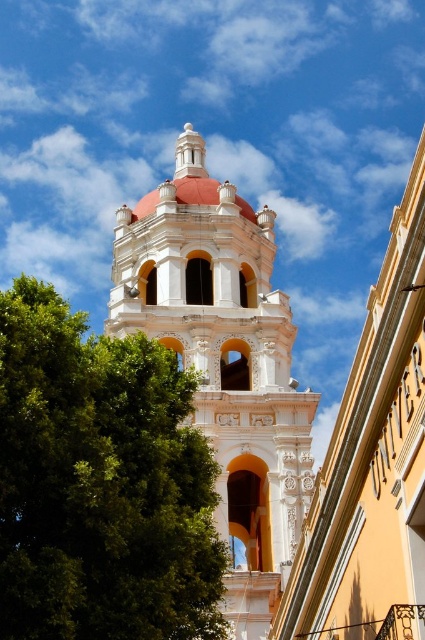
Question: Which object is the closest to the white stucco tower at center?

Choices:
 (A) white ornate tower at center
 (B) green leafy tree at left

Answer: (A)

Question: Which object is closer to the camera taking this photo?

Choices:
 (A) green leafy tree at left
 (B) white ornate tower at center
 (C) white stucco tower at center

Answer: (A)

Question: Does green leafy tree at left have a greater width compared to white ornate tower at center?

Choices:
 (A) no
 (B) yes

Answer: (A)

Question: Does green leafy tree at left appear under white stucco tower at center?

Choices:
 (A) yes
 (B) no

Answer: (A)

Question: Does green leafy tree at left appear over white stucco tower at center?

Choices:
 (A) yes
 (B) no

Answer: (B)

Question: Estimate the real-world distances between objects in this image. Which object is closer to the white stucco tower at center?

Choices:
 (A) green leafy tree at left
 (B) white ornate tower at center

Answer: (B)